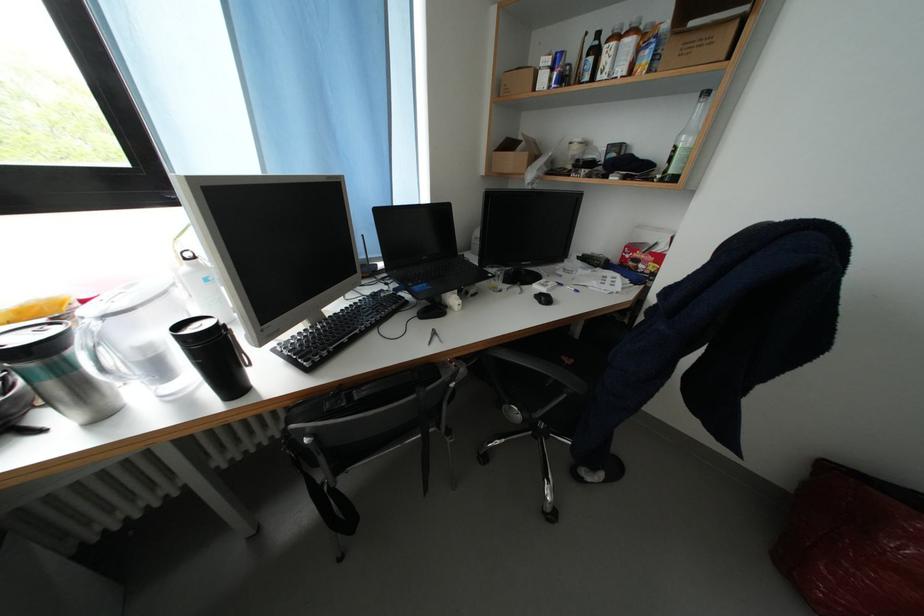
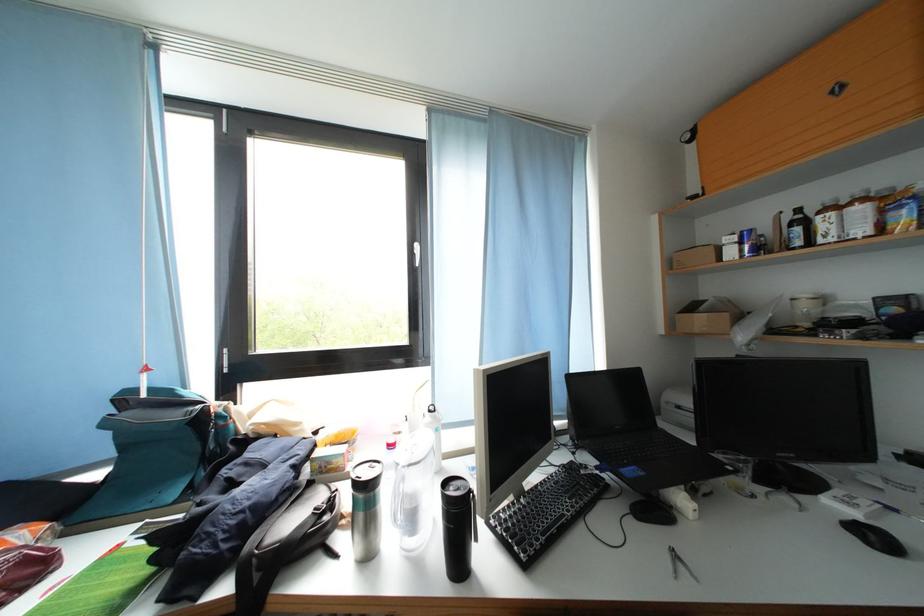
The point at (549, 307) is marked in the first image. Where is the corresponding point in the second image?

(877, 548)